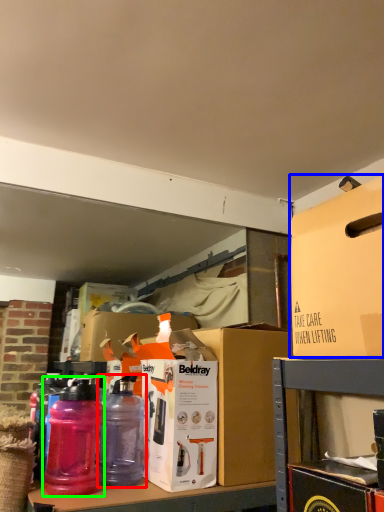
Question: Which is nearer to the bottle (highlighted by a red box)? box (highlighted by a blue box) or bottle (highlighted by a green box).

Choices:
 (A) box
 (B) bottle

Answer: (B)